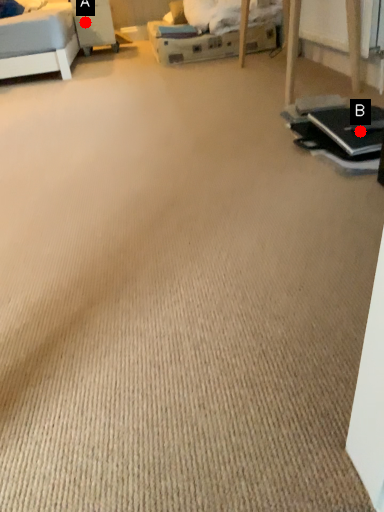
Question: Two points are circled on the image, labeled by A and B beside each circle. Which of the following is the closest to the observer?

Choices:
 (A) A is closer
 (B) B is closer

Answer: (B)